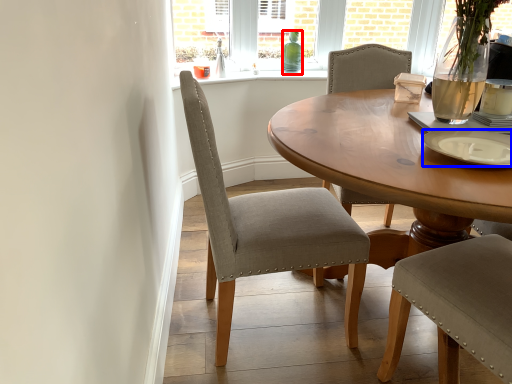
Question: Which of the following is the farthest to the observer, bottle (highlighted by a red box) or plate (highlighted by a blue box)?

Choices:
 (A) bottle
 (B) plate

Answer: (A)